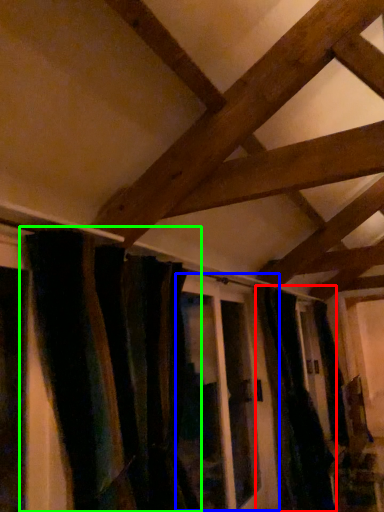
Question: Based on their relative distances, which object is farther from curtain (highlighted by a red box)? Choose from screen door (highlighted by a blue box) and curtain (highlighted by a green box).

Choices:
 (A) screen door
 (B) curtain

Answer: (B)